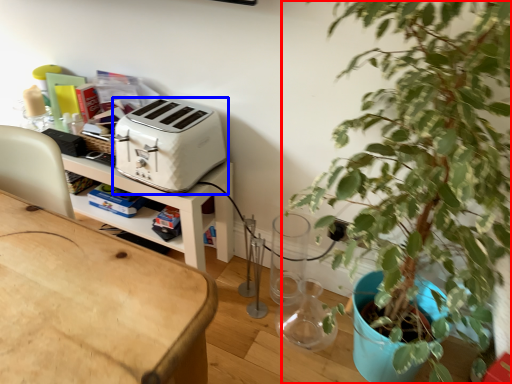
Question: Which of the following is the closest to the observer, houseplant (highlighted by a red box) or toaster (highlighted by a blue box)?

Choices:
 (A) houseplant
 (B) toaster

Answer: (A)